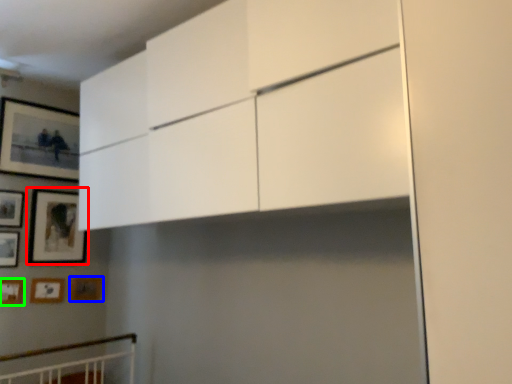
Question: Which object is the farthest from picture frame (highlighted by a red box)? Choose among these: picture frame (highlighted by a blue box) or picture frame (highlighted by a green box).

Choices:
 (A) picture frame
 (B) picture frame

Answer: (B)